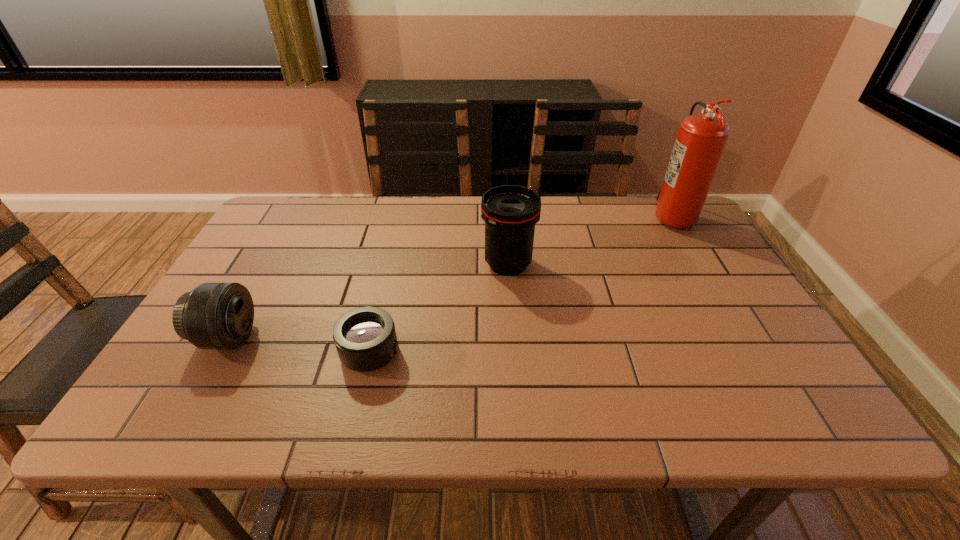
At what (x,y) coordinates should I click in order to perform the action: click on vacant area located 0.110m on the instruction side of the rightmost object. Please return your answer as a coordinate pair (x, y). This screenshot has width=960, height=540. Looking at the image, I should click on (616, 215).

Locate an element on the screen. The height and width of the screenshot is (540, 960). vacant area located 0.310m on the right of the farthest telephoto lens is located at coordinates (649, 264).

Identify the location of vacant space located 0.260m on the front-facing side of the leftmost telephoto lens. This screenshot has height=540, width=960. (370, 338).

At what (x,y) coordinates should I click in order to perform the action: click on vacant area located on the side of the second telephoto lens from right to left with brand markings and control switches. Please return your answer as a coordinate pair (x, y). This screenshot has width=960, height=540. Looking at the image, I should click on (556, 353).

This screenshot has width=960, height=540. I want to click on object at the far edge, so click(x=701, y=139).

Find the location of a particular element. Image resolution: width=960 pixels, height=540 pixels. object that is at the left edge is located at coordinates (220, 315).

I want to click on object at the right edge, so [x=701, y=139].

Identify the location of object positioned at the far right corner. (701, 139).

I want to click on free spot at the far edge of the desktop, so click(x=456, y=199).

You are a GUI agent. You are given a task and a screenshot of the screen. Output one action in this format:
    pyautogui.click(x=<x>, y=<y>)
    Task: Click on the free spot at the left edge of the desktop
    This screenshot has height=540, width=960.
    Given the screenshot: What is the action you would take?
    pyautogui.click(x=262, y=285)